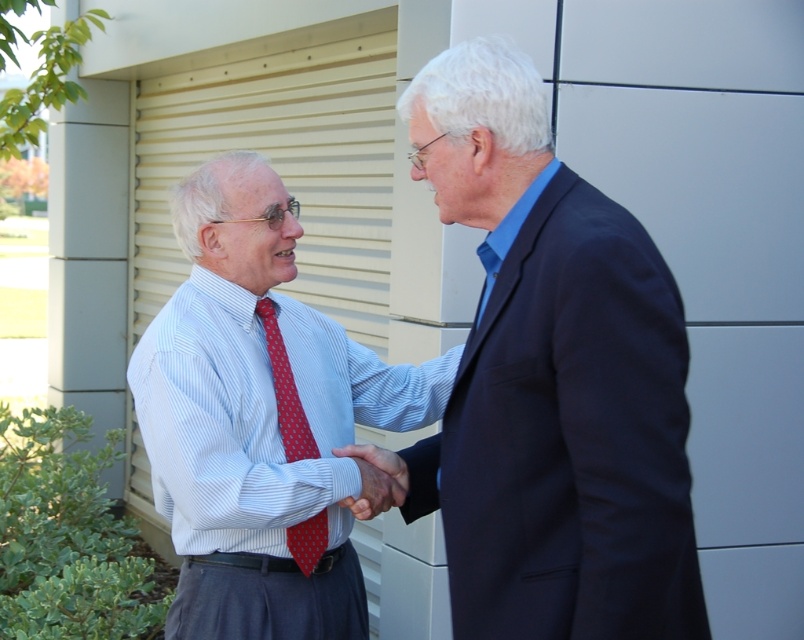
Is striped cotton shirt at center smaller than matte red tie at center?

No, striped cotton shirt at center is not smaller than matte red tie at center.

Between striped cotton shirt at center and matte red tie at center, which one appears on the right side from the viewer's perspective?

Positioned to the right is matte red tie at center.

Is point (175, 612) closer to camera compared to point (375, 464)?

No, it is behind (375, 464).

I want to click on striped cotton shirt at center, so click(260, 419).

Between point (565, 244) and point (279, 468), which one is positioned in front?

Point (565, 244) is in front.

Does point (532, 96) come farther from viewer compared to point (253, 180)?

No, it is not.

This screenshot has width=804, height=640. Identify the location of blue fabric suit at center. (552, 381).

How distant is blue fabric suit at center from red dotted tie at center?

blue fabric suit at center is 29.79 inches from red dotted tie at center.

In the scene shown: Who is more forward, (423,147) or (318,524)?

Point (423,147)

Identify the location of blue fabric suit at center. The width and height of the screenshot is (804, 640). (552, 381).